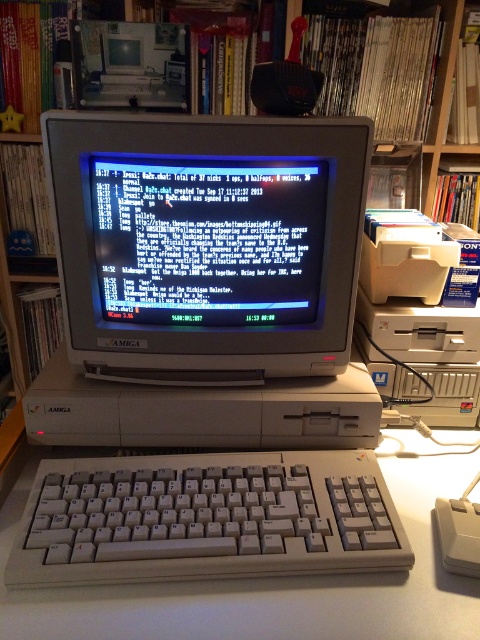
You are a photographer trying to capture a closeup of the Amiga monitor. You notice two points in the scene marked as point 1 at coordinates point [249,515] and point 2 at coordinates point [464,547]. Which point should you focus on to ensure the monitor is in sharp focus?

Point 1 at coordinates point [249,515] is further to the camera than point 2 at coordinates point [464,547], so focusing on point 1 will ensure the monitor is in sharp focus.

You are a technician examining a vintage Amiga computer setup. You notice a point marked at coordinates (205, 518). Based on the scene description, what object is located at that point?

The point at coordinates (205, 518) indicates the white plastic keyboard at lower center.

You are setting up a new desk and want to place the white plastic keyboard at lower center and the white plastic mouse at lower right. According to the image, which object should be placed on the left side of the desk?

The white plastic keyboard at lower center should be placed on the left side of the desk since it is positioned to the left of the white plastic mouse at lower right in the image.